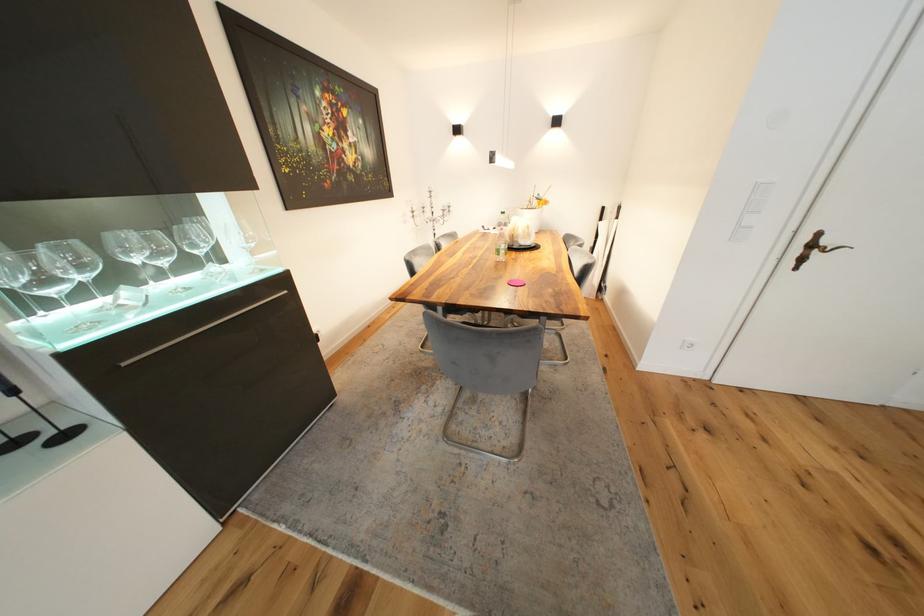
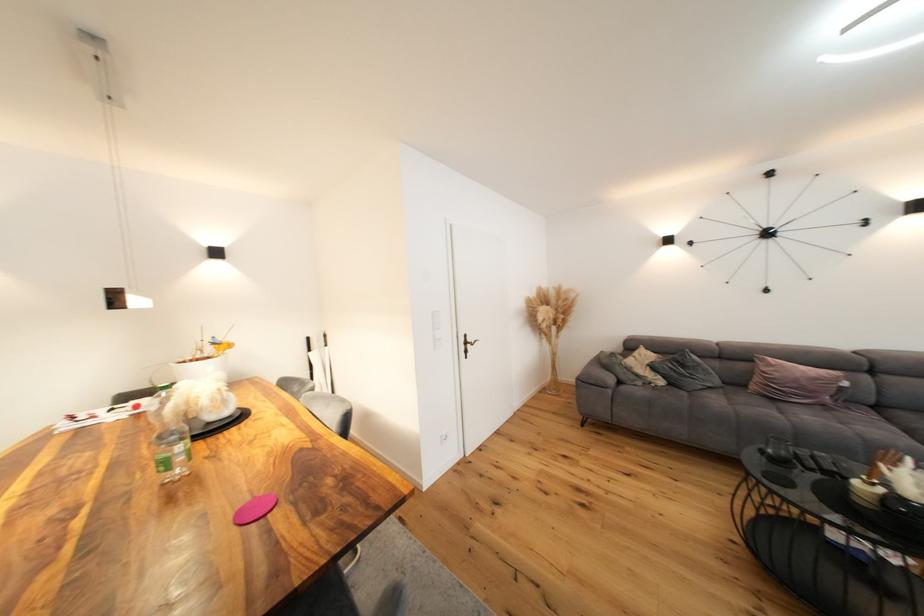
Where in the second image is the point corresponding to pixel 832 244 from the first image?

(476, 341)